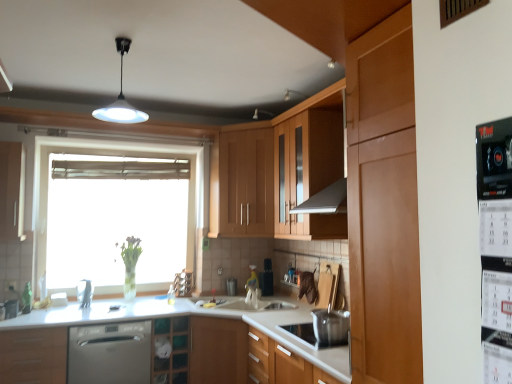
I want to click on white glossy light fixture at upper center, so click(121, 97).

Locate an element on the screen. The image size is (512, 384). black plastic toaster at center, acting as the first appliance starting from the left is located at coordinates (266, 278).

This screenshot has width=512, height=384. What do you see at coordinates (266, 278) in the screenshot?
I see `black plastic toaster at center, acting as the first appliance starting from the left` at bounding box center [266, 278].

Locate an element on the screen. This screenshot has height=384, width=512. transparent glass window at center is located at coordinates (113, 217).

Image resolution: width=512 pixels, height=384 pixels. Find the location of `white glossy sink at center`. white glossy sink at center is located at coordinates (249, 298).

The height and width of the screenshot is (384, 512). What are the coordinates of `white glossy light fixture at upper center` in the screenshot? It's located at (121, 97).

In terms of height, does transparent glass window at center look taller or shorter compared to wooden cabinet at upper center, which is counted as the 1th cabinetry, starting from the right?

Clearly, transparent glass window at center is taller compared to wooden cabinet at upper center, which is counted as the 1th cabinetry, starting from the right.

Considering the relative positions of transparent glass window at center and wooden cabinet at upper center, which is counted as the fourth cabinetry, starting from the left, in the image provided, is transparent glass window at center behind wooden cabinet at upper center, which is counted as the fourth cabinetry, starting from the left,?

No, transparent glass window at center is closer to the camera.

From the image's perspective, is transparent glass window at center above wooden cabinet at upper center, which is counted as the fourth cabinetry, starting from the left?

Actually, transparent glass window at center appears below wooden cabinet at upper center, which is counted as the fourth cabinetry, starting from the left, in the image.

Between transparent glass window at center and white plastic electric outlet at lower left, which one has less height?

→ white plastic electric outlet at lower left.

Are transparent glass window at center and white plastic electric outlet at lower left located far from each other?

Absolutely, transparent glass window at center is distant from white plastic electric outlet at lower left.

Which is behind, transparent glass window at center or white plastic electric outlet at lower left?

transparent glass window at center is further away from the camera.

Is point (200, 178) behind point (15, 289)?

Yes, point (200, 178) is farther from viewer.

Can we say matte wood cabinet at left, marked as the first cabinetry in a left-to-right arrangement, lies outside matte wood cabinet at lower left, marked as the second cabinetry in a left-to-right arrangement?

Yes, matte wood cabinet at left, marked as the first cabinetry in a left-to-right arrangement, is outside of matte wood cabinet at lower left, marked as the second cabinetry in a left-to-right arrangement.

From the picture: Is matte wood cabinet at left, marked as the first cabinetry in a left-to-right arrangement, further to the viewer compared to matte wood cabinet at lower left, which is the 3th cabinetry from right to left?

Yes, matte wood cabinet at left, marked as the first cabinetry in a left-to-right arrangement, is further from the camera.

Looking at this image, is matte wood cabinet at left, marked as the first cabinetry in a left-to-right arrangement, oriented towards matte wood cabinet at lower left, marked as the second cabinetry in a left-to-right arrangement?

No.

Considering the relative positions of black plastic toaster at center, which is the second appliance from front to back, and clear glass cabinet at center, the third cabinetry viewed from the left, in the image provided, is black plastic toaster at center, which is the second appliance from front to back, to the left or to the right of clear glass cabinet at center, the third cabinetry viewed from the left,?

Based on their positions, black plastic toaster at center, which is the second appliance from front to back, is located to the right of clear glass cabinet at center, the third cabinetry viewed from the left.

Could you measure the distance between black plastic toaster at center, placed as the 1th appliance when sorted from bottom to top, and clear glass cabinet at center, the third cabinetry viewed from the left?

3.30 feet.

From a real-world perspective, which is physically above, black plastic toaster at center, which is the first appliance in back-to-front order, or clear glass cabinet at center, the second cabinetry viewed from the right?

black plastic toaster at center, which is the first appliance in back-to-front order.

Considering the sizes of black plastic toaster at center, placed as the 1th appliance when sorted from bottom to top, and clear glass cabinet at center, the third cabinetry viewed from the left, in the image, is black plastic toaster at center, placed as the 1th appliance when sorted from bottom to top, bigger or smaller than clear glass cabinet at center, the third cabinetry viewed from the left,?

black plastic toaster at center, placed as the 1th appliance when sorted from bottom to top, is smaller than clear glass cabinet at center, the third cabinetry viewed from the left.

Which is in front, point (183, 349) or point (343, 337)?

Positioned in front is point (343, 337).

Looking at this image, is clear glass cabinet at center, the third cabinetry viewed from the left, at the right side of stainless steel pot at lower center?

No.

Looking at the image, does clear glass cabinet at center, the second cabinetry viewed from the right, seem bigger or smaller compared to stainless steel pot at lower center?

Clearly, clear glass cabinet at center, the second cabinetry viewed from the right, is larger in size than stainless steel pot at lower center.

Is matte wood cabinet at lower left, which is the 3th cabinetry from right to left, positioned far away from wooden cabinet at upper center, which is counted as the 1th cabinetry, starting from the right?

matte wood cabinet at lower left, which is the 3th cabinetry from right to left, is far away from wooden cabinet at upper center, which is counted as the 1th cabinetry, starting from the right.

I want to click on cabinetry that is the 3rd object located in front of the wooden cabinet at upper center, which is counted as the 1th cabinetry, starting from the right, so click(x=33, y=355).

Is point (30, 379) more distant than point (254, 168)?

No.

Does matte wood cabinet at lower left, marked as the second cabinetry in a left-to-right arrangement, have a lesser width compared to wooden cabinet at upper center, which is counted as the 1th cabinetry, starting from the right?

No, matte wood cabinet at lower left, marked as the second cabinetry in a left-to-right arrangement, is not thinner than wooden cabinet at upper center, which is counted as the 1th cabinetry, starting from the right.

Looking at this image, would you consider matte wood cabinet at left, marked as the first cabinetry in a left-to-right arrangement, to be distant from transparent glass window at center?

No.

Where is `window lying below the matte wood cabinet at left, the fourth cabinetry viewed from the right (from the image's perspective)`? window lying below the matte wood cabinet at left, the fourth cabinetry viewed from the right (from the image's perspective) is located at coordinates (113, 217).

From a real-world perspective, which is physically below, matte wood cabinet at left, the fourth cabinetry viewed from the right, or transparent glass window at center?

transparent glass window at center.

Is transparent glass window at center completely or partially inside matte wood cabinet at left, marked as the first cabinetry in a left-to-right arrangement?

No, transparent glass window at center is not inside matte wood cabinet at left, marked as the first cabinetry in a left-to-right arrangement.

There is a transparent glass window at center. Where is `the 2nd cabinetry above it (from a real-world perspective)`? The image size is (512, 384). the 2nd cabinetry above it (from a real-world perspective) is located at coordinates [x=242, y=184].

You are a GUI agent. You are given a task and a screenshot of the screen. Output one action in this format:
    pyautogui.click(x=<x>, y=<y>)
    Task: Click on the window on the right side of white plastic electric outlet at lower left
    The width and height of the screenshot is (512, 384).
    Given the screenshot: What is the action you would take?
    pyautogui.click(x=113, y=217)

Which object lies nearer to the anchor point transparent glass window at center, wooden cabinet at upper center, which is counted as the fourth cabinetry, starting from the left, or white glossy sink at center?

wooden cabinet at upper center, which is counted as the fourth cabinetry, starting from the left, is closer to transparent glass window at center.

From the image, which object appears to be farther from white plastic electric outlet at lower left, white glossy light fixture at upper center or black plastic toaster at center, the 2th appliance viewed from the right?

Based on the image, black plastic toaster at center, the 2th appliance viewed from the right, appears to be further to white plastic electric outlet at lower left.

From the image, which object appears to be nearer to matte wood cabinet at lower left, which is the 3th cabinetry from right to left, clear glass cabinet at center, the second cabinetry viewed from the right, or black plastic toaster at center, the 2th appliance viewed from the right?

Based on the image, clear glass cabinet at center, the second cabinetry viewed from the right, appears to be nearer to matte wood cabinet at lower left, which is the 3th cabinetry from right to left.

When comparing their distances from matte wood cabinet at left, marked as the first cabinetry in a left-to-right arrangement, does transparent glass window at center or black plastic calendar at right, the 1th appliance viewed from the right, seem further?

black plastic calendar at right, the 1th appliance viewed from the right, is further to matte wood cabinet at left, marked as the first cabinetry in a left-to-right arrangement.

Considering their positions, is stainless steel pot at lower center positioned closer to matte wood cabinet at lower left, which is the 3th cabinetry from right to left, than black plastic toaster at center, which is the second appliance in top-to-bottom order?

stainless steel pot at lower center lies closer to matte wood cabinet at lower left, which is the 3th cabinetry from right to left, than the other object.

When comparing their distances from wooden cabinet at upper center, which is counted as the 1th cabinetry, starting from the right, does stainless steel pot at lower center or white plastic electric outlet at lower left seem further?

white plastic electric outlet at lower left is further to wooden cabinet at upper center, which is counted as the 1th cabinetry, starting from the right.

Looking at the image, which one is located closer to clear glass cabinet at center, the third cabinetry viewed from the left, black plastic calendar at right, acting as the second appliance starting from the back, or satin silver dishwasher at lower left?

satin silver dishwasher at lower left is closer to clear glass cabinet at center, the third cabinetry viewed from the left.

Which object lies nearer to the anchor point white plastic electric outlet at lower left, white glossy light fixture at upper center or wooden cabinet at upper center, which is counted as the fourth cabinetry, starting from the left?

Among the two, white glossy light fixture at upper center is located nearer to white plastic electric outlet at lower left.

Find the location of a particular element. cabinetry between matte wood cabinet at left, marked as the first cabinetry in a left-to-right arrangement, and satin silver dishwasher at lower left from top to bottom is located at coordinates (33, 355).

Where is `home appliance between transparent glass window at center and white glossy sink at center in the horizontal direction`? Image resolution: width=512 pixels, height=384 pixels. home appliance between transparent glass window at center and white glossy sink at center in the horizontal direction is located at coordinates (110, 353).

You are a GUI agent. You are given a task and a screenshot of the screen. Output one action in this format:
    pyautogui.click(x=<x>, y=<y>)
    Task: Click on the home appliance between matte wood cabinet at left, marked as the first cabinetry in a left-to-right arrangement, and clear glass cabinet at center, the third cabinetry viewed from the left, in the up-down direction
    
    Given the screenshot: What is the action you would take?
    pyautogui.click(x=110, y=353)

Where is `home appliance between white plastic electric outlet at lower left and wooden cabinet at upper center, which is counted as the 1th cabinetry, starting from the right`? The width and height of the screenshot is (512, 384). home appliance between white plastic electric outlet at lower left and wooden cabinet at upper center, which is counted as the 1th cabinetry, starting from the right is located at coordinates (110, 353).